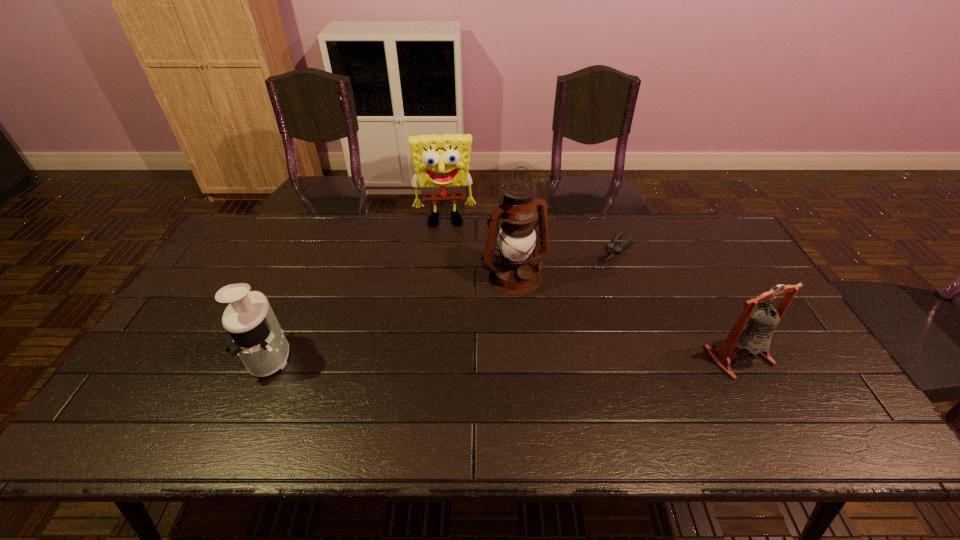
Locate an element on the screen. The width and height of the screenshot is (960, 540). unoccupied area between the leftmost object and the bell is located at coordinates (505, 356).

The height and width of the screenshot is (540, 960). Identify the location of empty space between the tallest object and the fourth object from left to right. (565, 263).

Image resolution: width=960 pixels, height=540 pixels. What are the coordinates of `free space between the juicer and the bell` in the screenshot? It's located at (505, 356).

You are a GUI agent. You are given a task and a screenshot of the screen. Output one action in this format:
    pyautogui.click(x=<x>, y=<y>)
    Task: Click on the empty location between the second object from left to right and the tallest object
    This screenshot has height=540, width=960.
    Given the screenshot: What is the action you would take?
    pyautogui.click(x=479, y=250)

Find the location of a particular element. free space between the bell and the farthest object is located at coordinates (591, 289).

What are the coordinates of `unoccupied area between the juicer and the pliers` in the screenshot? It's located at (444, 302).

Where is `vacant area between the second object from left to right and the rightmost object`? vacant area between the second object from left to right and the rightmost object is located at coordinates (591, 289).

This screenshot has width=960, height=540. I want to click on free space between the tallest object and the pliers, so click(x=565, y=263).

Where is `vacant area that lies between the third object from left to right and the shortest object`? vacant area that lies between the third object from left to right and the shortest object is located at coordinates (565, 263).

You are a GUI agent. You are given a task and a screenshot of the screen. Output one action in this format:
    pyautogui.click(x=<x>, y=<y>)
    Task: Click on the object identified as the third closest to the lantern
    
    Given the screenshot: What is the action you would take?
    pyautogui.click(x=752, y=333)